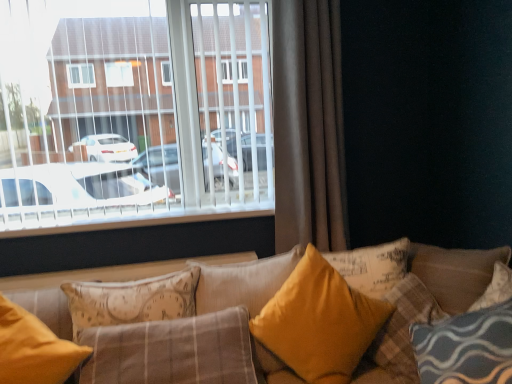
Describe the element at coordinates (197, 122) in the screenshot. The image size is (512, 384). I see `white plastic blinds at upper left` at that location.

Measure the distance between point (312, 322) and camera.

Point (312, 322) and camera are 5.55 feet apart from each other.

This screenshot has width=512, height=384. In order to click on yellow fabric pillow at center, placed as the 5th pillow when sorted from left to right in this screenshot , I will do `click(404, 328)`.

Consider the image. Can you confirm if yellow fabric pillow at center, placed as the 5th pillow when sorted from left to right, is taller than yellow fabric pillow at center, which appears as the 2th pillow when viewed from the left?

In fact, yellow fabric pillow at center, placed as the 5th pillow when sorted from left to right, may be shorter than yellow fabric pillow at center, which appears as the 2th pillow when viewed from the left.

Based on the photo, in terms of width, does yellow fabric pillow at center, placed as the 5th pillow when sorted from left to right, look wider or thinner when compared to yellow fabric pillow at center, which is the 4th pillow from right to left?

yellow fabric pillow at center, placed as the 5th pillow when sorted from left to right, is wider than yellow fabric pillow at center, which is the 4th pillow from right to left.

From a real-world perspective, relative to yellow fabric pillow at center, which appears as the 2th pillow when viewed from the left, is yellow fabric pillow at center, placed as the 5th pillow when sorted from left to right, vertically above or below?

From a real-world perspective, yellow fabric pillow at center, placed as the 5th pillow when sorted from left to right, is physically below yellow fabric pillow at center, which appears as the 2th pillow when viewed from the left.

Does brown fabric curtain at right have a larger size compared to velvet yellow pillow at center, arranged as the 3th pillow when viewed from the left?

Actually, brown fabric curtain at right might be smaller than velvet yellow pillow at center, arranged as the 3th pillow when viewed from the left.

From the image's perspective, which one is positioned lower, brown fabric curtain at right or velvet yellow pillow at center, the third pillow when ordered from right to left?

velvet yellow pillow at center, the third pillow when ordered from right to left, from the image's perspective.

Who is shorter, brown fabric curtain at right or velvet yellow pillow at center, arranged as the 3th pillow when viewed from the left?

velvet yellow pillow at center, arranged as the 3th pillow when viewed from the left, is shorter.

Would you say brown fabric curtain at right is to the left or to the right of velvet yellow pillow at center, the third pillow when ordered from right to left, in the picture?

brown fabric curtain at right is positioned on velvet yellow pillow at center, the third pillow when ordered from right to left,'s right side.

From a real-world perspective, which is physically above, yellow fabric pillow at center, which is the first pillow in right-to-left order, or velvet yellow pillow at center, arranged as the 3th pillow when viewed from the left?

From a 3D spatial view, velvet yellow pillow at center, arranged as the 3th pillow when viewed from the left, is above.

Is yellow fabric pillow at center, placed as the 5th pillow when sorted from left to right, aimed at velvet yellow pillow at center, arranged as the 3th pillow when viewed from the left?

Yes, yellow fabric pillow at center, placed as the 5th pillow when sorted from left to right, faces towards velvet yellow pillow at center, arranged as the 3th pillow when viewed from the left.

Between yellow fabric pillow at center, placed as the 5th pillow when sorted from left to right, and velvet yellow pillow at center, the third pillow when ordered from right to left, which one appears on the right side from the viewer's perspective?

Positioned to the right is yellow fabric pillow at center, placed as the 5th pillow when sorted from left to right.

From the image's perspective, which one is positioned lower, yellow fabric pillow at center, which is the first pillow in right-to-left order, or velvet yellow pillow at center, arranged as the 3th pillow when viewed from the left?

From the image's view, yellow fabric pillow at center, which is the first pillow in right-to-left order, is below.

From the image's perspective, is yellow fabric pillow at center, which appears as the 2th pillow when viewed from the left, positioned above or below yellow fabric pillow at center, which is the first pillow in right-to-left order?

From the image's perspective, yellow fabric pillow at center, which appears as the 2th pillow when viewed from the left, appears above yellow fabric pillow at center, which is the first pillow in right-to-left order.

The height and width of the screenshot is (384, 512). I want to click on pillow that is the 3rd one when counting leftward from the yellow fabric pillow at center, placed as the 5th pillow when sorted from left to right, so click(243, 282).

Is the depth of yellow fabric pillow at center, which appears as the 2th pillow when viewed from the left, greater than that of yellow fabric pillow at center, which is the first pillow in right-to-left order?

Yes, yellow fabric pillow at center, which appears as the 2th pillow when viewed from the left, is further from the camera.

From a real-world perspective, is matte yellow pillow at lower left, which is counted as the 5th pillow, starting from the right, on velvet yellow pillow at center, the 2th pillow viewed from the right?

Incorrect, from a real-world perspective, matte yellow pillow at lower left, which is counted as the 5th pillow, starting from the right, is lower than velvet yellow pillow at center, the 2th pillow viewed from the right.

Which is behind, matte yellow pillow at lower left, which is counted as the 5th pillow, starting from the right, or velvet yellow pillow at center, the 2th pillow viewed from the right?

Positioned behind is velvet yellow pillow at center, the 2th pillow viewed from the right.

Is velvet yellow pillow at center, the 2th pillow viewed from the right, at the back of matte yellow pillow at lower left, which is counted as the 5th pillow, starting from the right?

No, matte yellow pillow at lower left, which is counted as the 5th pillow, starting from the right,'s orientation is not away from velvet yellow pillow at center, the 2th pillow viewed from the right.

From the image's perspective, would you say white plastic blinds at upper left is shown under velvet yellow pillow at center, which appears as the fourth pillow when viewed from the left?

Incorrect, from the image's perspective, white plastic blinds at upper left is higher than velvet yellow pillow at center, which appears as the fourth pillow when viewed from the left.

Can you confirm if white plastic blinds at upper left is smaller than velvet yellow pillow at center, which appears as the fourth pillow when viewed from the left?

No, white plastic blinds at upper left is not smaller than velvet yellow pillow at center, which appears as the fourth pillow when viewed from the left.

What are the coordinates of `pillow that is the 1st object located below the white plastic blinds at upper left (from the image's perspective)` in the screenshot? It's located at (372, 266).

Is white plastic blinds at upper left not near velvet yellow pillow at center, the 2th pillow viewed from the right?

That's not correct — white plastic blinds at upper left is a little close to velvet yellow pillow at center, the 2th pillow viewed from the right.

From the image's perspective, is matte yellow pillow at lower left, which appears as the first pillow when viewed from the left, above or below brown fabric curtain at right?

Clearly, from the image's perspective, matte yellow pillow at lower left, which appears as the first pillow when viewed from the left, is below brown fabric curtain at right.

Are matte yellow pillow at lower left, which is counted as the 5th pillow, starting from the right, and brown fabric curtain at right far apart?

Yes, matte yellow pillow at lower left, which is counted as the 5th pillow, starting from the right, and brown fabric curtain at right are located far from each other.

Can we say matte yellow pillow at lower left, which appears as the first pillow when viewed from the left, lies outside brown fabric curtain at right?

That's correct, matte yellow pillow at lower left, which appears as the first pillow when viewed from the left, is outside of brown fabric curtain at right.

What's the angular difference between matte yellow pillow at lower left, which appears as the first pillow when viewed from the left, and brown fabric curtain at right's facing directions?

The angular difference between matte yellow pillow at lower left, which appears as the first pillow when viewed from the left, and brown fabric curtain at right is 0.63 degrees.

From a real-world perspective, count 3rd pillows downward from the yellow fabric pillow at center, which is the 4th pillow from right to left, and point to it. Please provide its 2D coordinates.

[(404, 328)]

The height and width of the screenshot is (384, 512). What are the coordinates of `curtain above the velvet yellow pillow at center, the third pillow when ordered from right to left (from the image's perspective)` in the screenshot? It's located at (308, 125).

When comparing their distances from yellow fabric pillow at center, placed as the 5th pillow when sorted from left to right, does brown fabric curtain at right or velvet yellow pillow at center, arranged as the 3th pillow when viewed from the left, seem further?

Based on the image, brown fabric curtain at right appears to be further to yellow fabric pillow at center, placed as the 5th pillow when sorted from left to right.

Looking at the image, which one is located closer to brown fabric curtain at right, velvet yellow pillow at center, which appears as the fourth pillow when viewed from the left, or matte yellow pillow at lower left, which is counted as the 5th pillow, starting from the right?

Based on the image, velvet yellow pillow at center, which appears as the fourth pillow when viewed from the left, appears to be nearer to brown fabric curtain at right.

Estimate the real-world distances between objects in this image. Which object is closer to velvet yellow pillow at center, which appears as the fourth pillow when viewed from the left, white plastic blinds at upper left or yellow fabric pillow at center, which is the first pillow in right-to-left order?

Based on the image, yellow fabric pillow at center, which is the first pillow in right-to-left order, appears to be nearer to velvet yellow pillow at center, which appears as the fourth pillow when viewed from the left.

From the image, which object appears to be farther from brown fabric curtain at right, yellow fabric pillow at center, which is the 4th pillow from right to left, or velvet yellow pillow at center, which appears as the fourth pillow when viewed from the left?

yellow fabric pillow at center, which is the 4th pillow from right to left, is positioned further to the anchor brown fabric curtain at right.

From the image, which object appears to be farther from velvet yellow pillow at center, arranged as the 3th pillow when viewed from the left, white plastic blinds at upper left or yellow fabric pillow at center, which is the 4th pillow from right to left?

Based on the image, white plastic blinds at upper left appears to be further to velvet yellow pillow at center, arranged as the 3th pillow when viewed from the left.

Considering their positions, is velvet yellow pillow at center, the 2th pillow viewed from the right, positioned further to yellow fabric pillow at center, which is the 4th pillow from right to left, than white plastic blinds at upper left?

white plastic blinds at upper left.

Looking at the image, which one is located closer to velvet yellow pillow at center, the 2th pillow viewed from the right, brown fabric curtain at right or white plastic blinds at upper left?

brown fabric curtain at right is closer to velvet yellow pillow at center, the 2th pillow viewed from the right.

From the image, which object appears to be nearer to brown fabric curtain at right, velvet yellow pillow at center, which appears as the fourth pillow when viewed from the left, or white plastic blinds at upper left?

white plastic blinds at upper left is closer to brown fabric curtain at right.

You are a GUI agent. You are given a task and a screenshot of the screen. Output one action in this format:
    pyautogui.click(x=<x>, y=<y>)
    Task: Click on the curtain that lies between white plastic blinds at upper left and velvet yellow pillow at center, arranged as the 3th pillow when viewed from the left, from top to bottom
    The image size is (512, 384).
    Given the screenshot: What is the action you would take?
    pyautogui.click(x=308, y=125)

Where is `window between matte yellow pillow at lower left, which is counted as the 5th pillow, starting from the right, and velvet yellow pillow at center, arranged as the 3th pillow when viewed from the left`? The height and width of the screenshot is (384, 512). window between matte yellow pillow at lower left, which is counted as the 5th pillow, starting from the right, and velvet yellow pillow at center, arranged as the 3th pillow when viewed from the left is located at coordinates (197, 122).

The image size is (512, 384). I want to click on curtain between white plastic blinds at upper left and velvet yellow pillow at center, which appears as the fourth pillow when viewed from the left, in the horizontal direction, so click(308, 125).

This screenshot has height=384, width=512. In order to click on curtain between white plastic blinds at upper left and yellow fabric pillow at center, which is the 4th pillow from right to left, from top to bottom in this screenshot , I will do `click(308, 125)`.